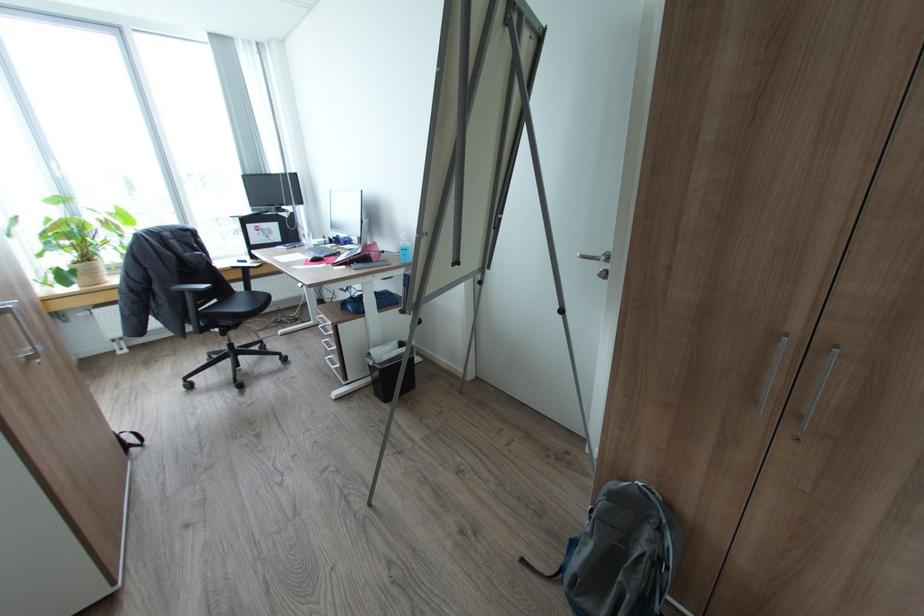
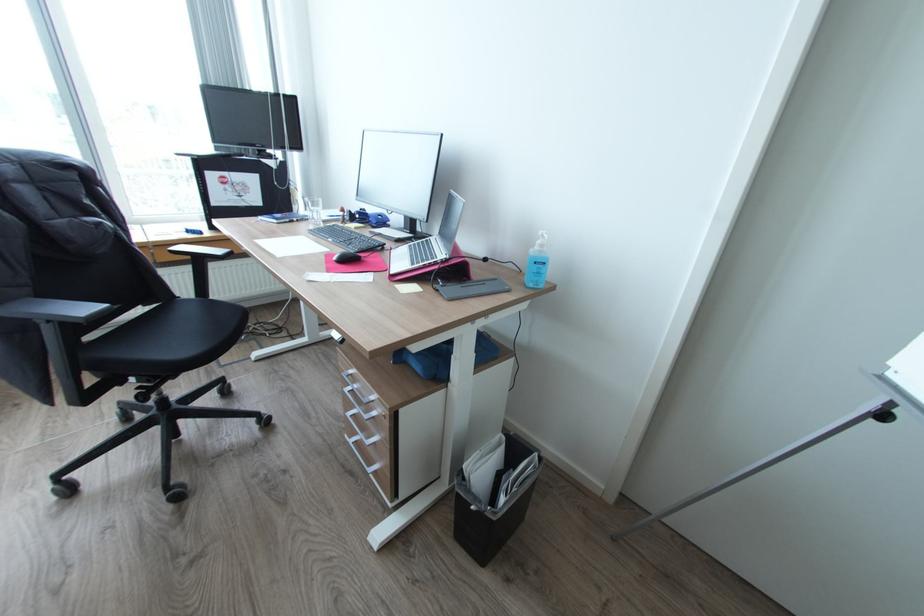
In the second image, find the point that corresponds to [325,315] in the first image.

(357, 371)